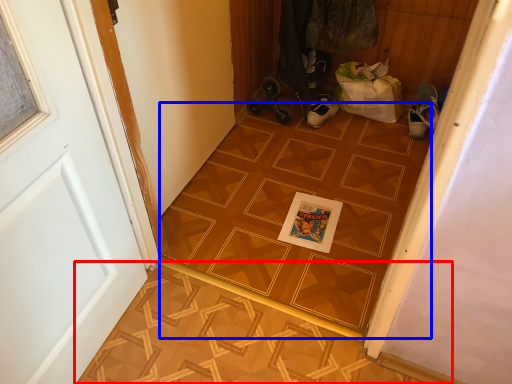
Question: Which object appears farthest to the camera in this image, tile (highlighted by a red box) or ceramic tile (highlighted by a blue box)?

Choices:
 (A) tile
 (B) ceramic tile

Answer: (B)